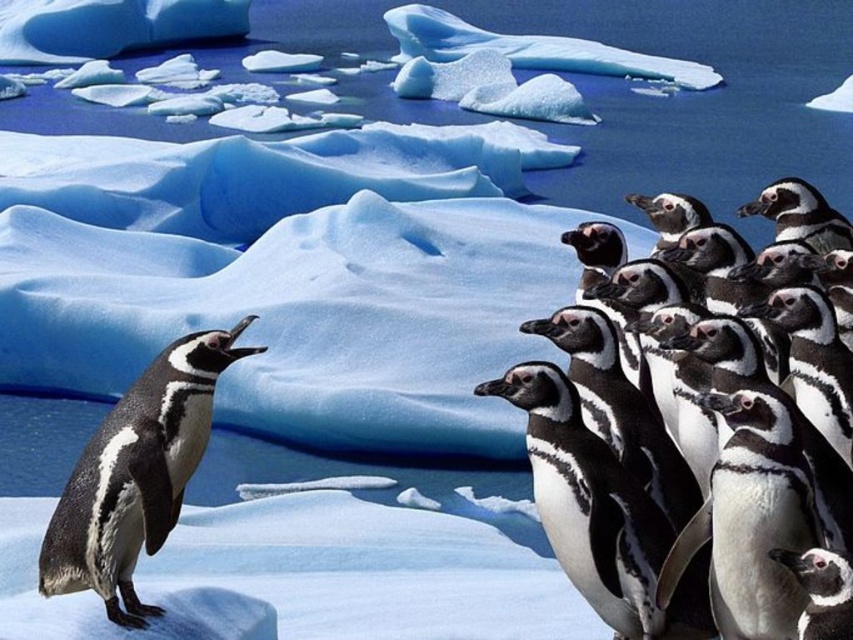
You are a wildlife photographer aiming to capture a photo of the black matte penguin at right and the black matte penguin at lower right. Which penguin should you focus on first to ensure it appears closer in the photo?

You should focus on the black matte penguin at right first because it is closer to the viewer than the black matte penguin at lower right, making it appear closer in the photo.

You are a wildlife photographer observing the penguins. You need to capture a photo where both the black matte penguin at right and the black matte penguin at lower right are visible. Based on their positions, which penguin should you focus on first to ensure both are in frame?

The black matte penguin at right is located above the black matte penguin at lower right, so focusing on the black matte penguin at right first will allow you to adjust the camera angle downward to include the black matte penguin at lower right in the frame.